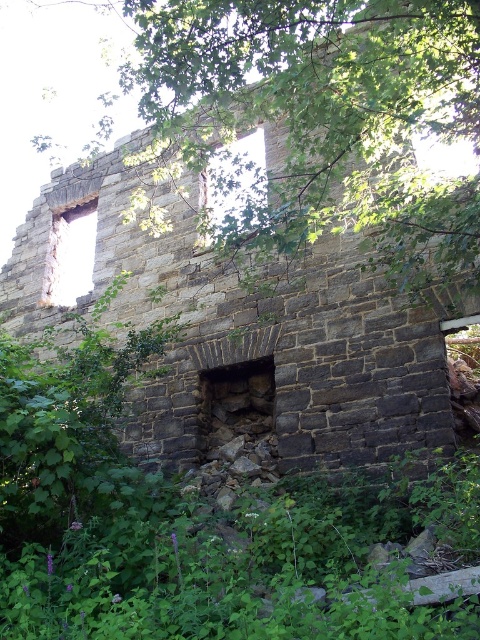
Question: Is matte stone window at center above transparent glass window at upper left?

Choices:
 (A) no
 (B) yes

Answer: (B)

Question: Which point is farther to the camera?

Choices:
 (A) matte stone window at center
 (B) transparent glass window at upper left

Answer: (B)

Question: Does green leafy tree at upper center appear over matte stone window at center?

Choices:
 (A) yes
 (B) no

Answer: (A)

Question: Among these points, which one is nearest to the camera?

Choices:
 (A) (51, 234)
 (B) (243, 192)
 (C) (199, 108)

Answer: (B)

Question: Is green leafy tree at upper center positioned before transparent glass window at upper left?

Choices:
 (A) yes
 (B) no

Answer: (A)

Question: Estimate the real-world distances between objects in this image. Which object is farther from the transparent glass window at upper left?

Choices:
 (A) green leafy tree at upper center
 (B) matte stone window at center

Answer: (A)